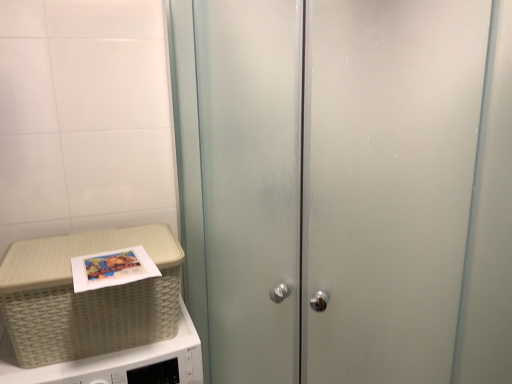
Question: Visually, is white woven basket at left positioned to the left or to the right of beige woven picnic basket at lower left?

Choices:
 (A) right
 (B) left

Answer: (B)

Question: Is point (22, 382) positioned closer to the camera than point (159, 324)?

Choices:
 (A) closer
 (B) farther

Answer: (A)

Question: Considering the real-world distances, which object is closest to the white woven basket at left?

Choices:
 (A) beige woven picnic basket at lower left
 (B) frosted glass cabinet at center

Answer: (A)

Question: Estimate the real-world distances between objects in this image. Which object is farther from the frosted glass cabinet at center?

Choices:
 (A) white woven basket at left
 (B) beige woven picnic basket at lower left

Answer: (A)